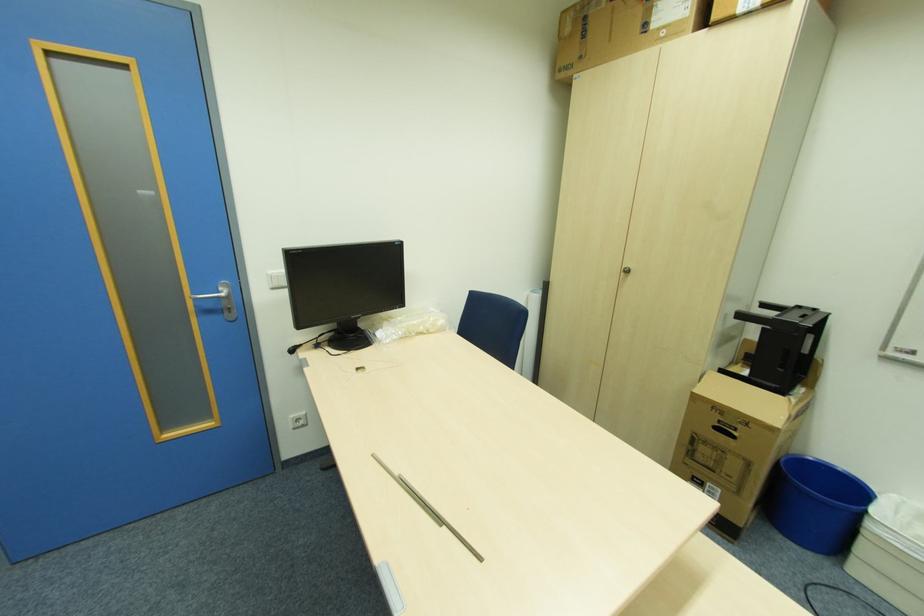
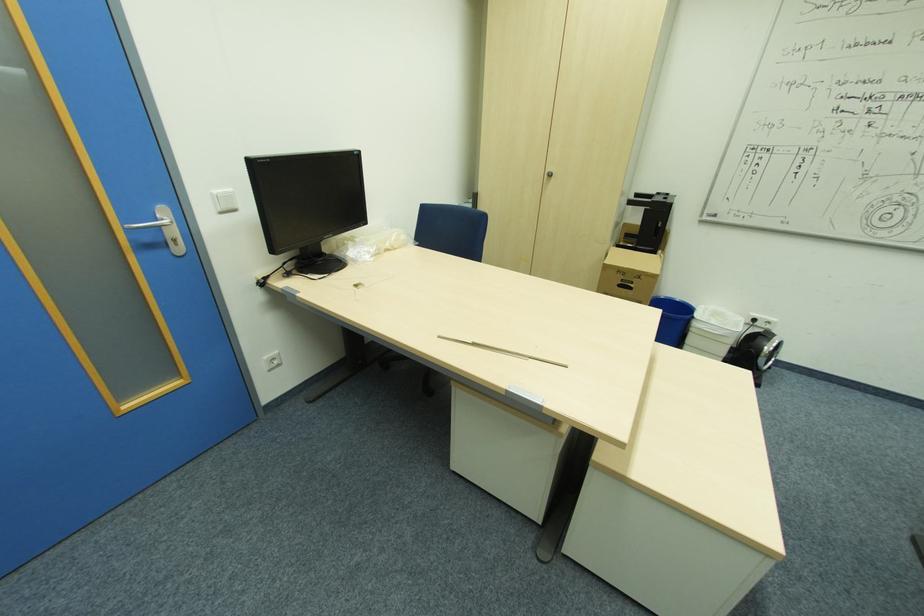
In the second image, find the point that corresponds to the point at 629,270 in the first image.

(553, 175)